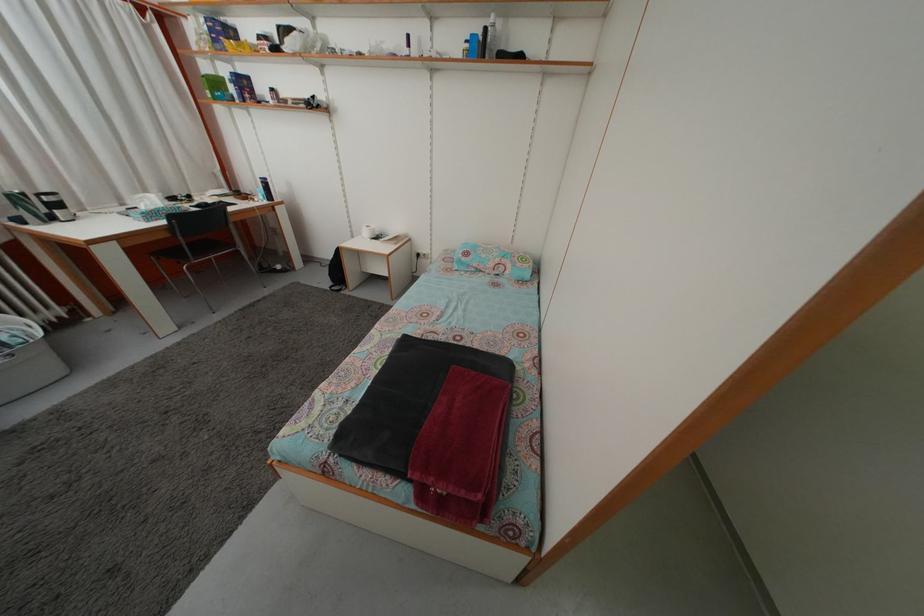
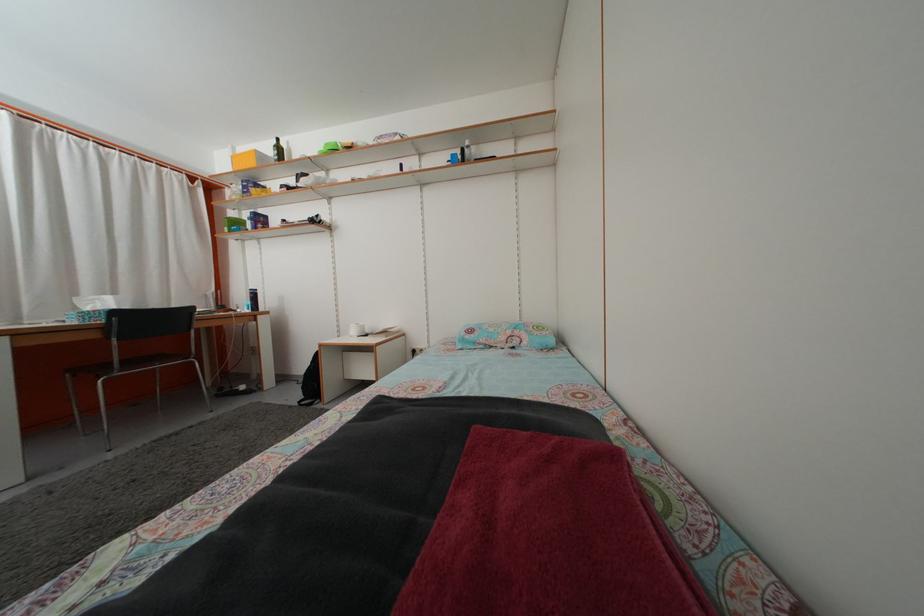
Where in the second image is the point corresponding to pixel 150 215 from the first image?

(94, 317)